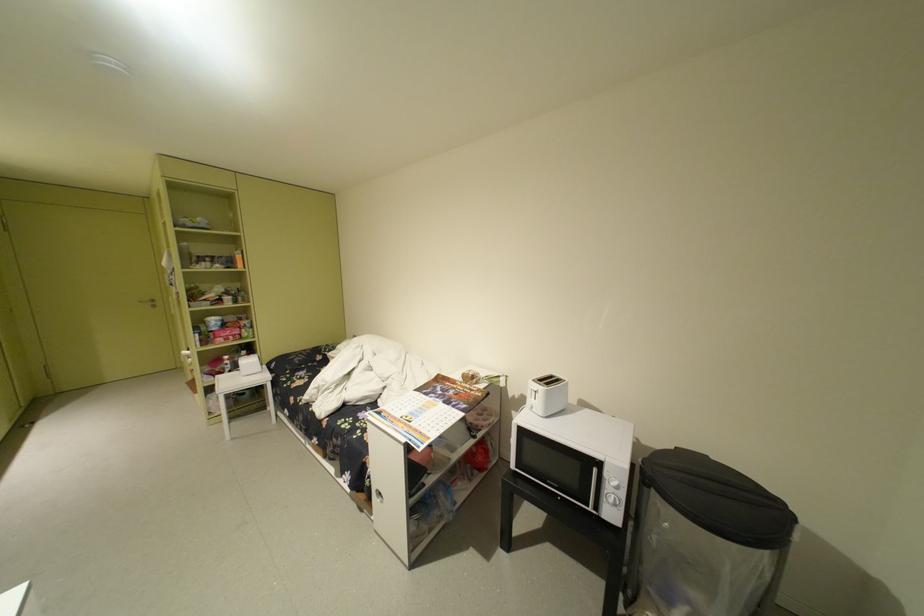
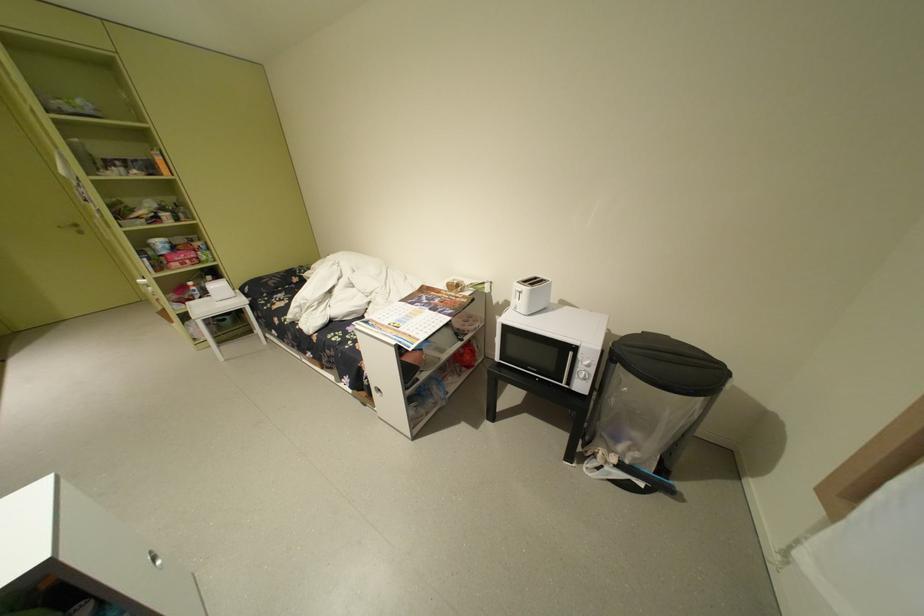
Find the pixel in the second image that matches the point at 658,488 in the first image.

(624, 365)